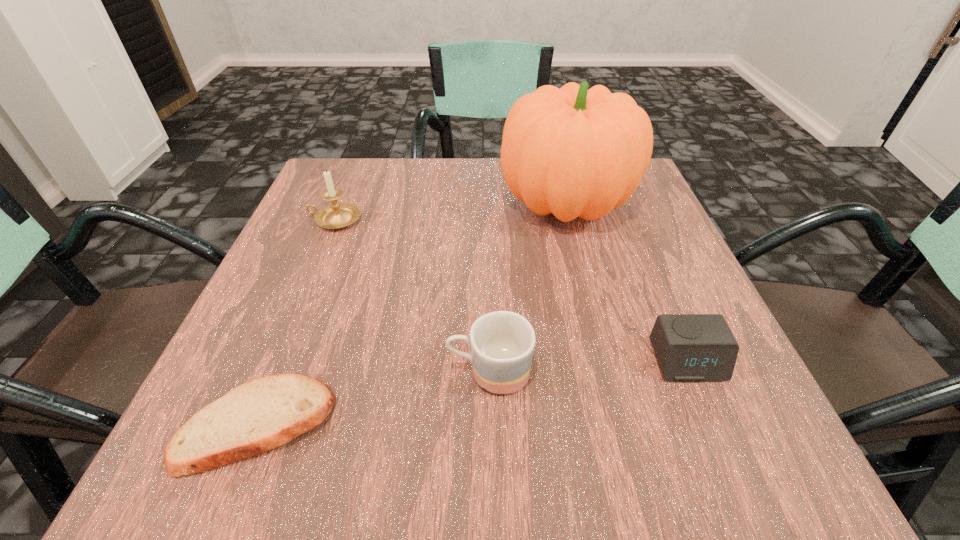
In order to click on vacant area that lies between the fourth tallest object and the pumpkin in this screenshot , I will do `click(627, 282)`.

The height and width of the screenshot is (540, 960). I want to click on vacant point located between the tallest object and the shortest object, so click(412, 314).

Identify the location of vacant area that lies between the pita bread and the alarm clock. The height and width of the screenshot is (540, 960). (472, 393).

Find the location of a particular element. This screenshot has height=540, width=960. vacant region between the pita bread and the pumpkin is located at coordinates (412, 314).

Find the location of a particular element. The image size is (960, 540). free space between the pita bread and the alarm clock is located at coordinates (472, 393).

Locate an element on the screen. vacant area between the third shortest object and the shortest object is located at coordinates (373, 398).

Identify the location of free space between the second shortest object and the candle holder. (511, 291).

Image resolution: width=960 pixels, height=540 pixels. I want to click on object identified as the second closest to the third shortest object, so click(689, 347).

The image size is (960, 540). In order to click on the closest object to the alarm clock in this screenshot , I will do coord(502,343).

Identify the location of blank area in the image that satisfies the following two spatial constraints: 1. on the front-facing side of the second shortest object; 2. on the side with the handle of the mug. (692, 372).